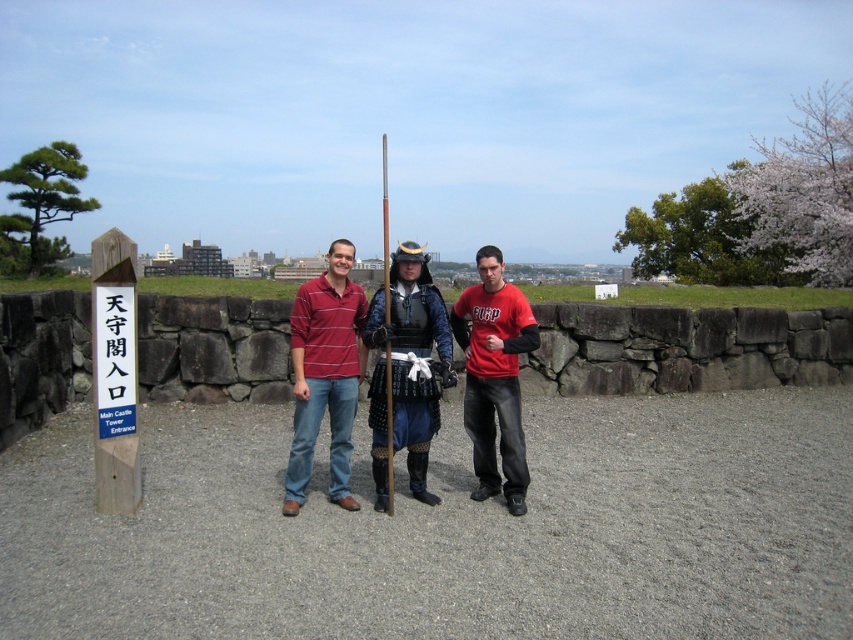
Between matte black armor at center and black textured armor at center, which one has less height?

black textured armor at center is shorter.

Identify the location of matte black armor at center. The width and height of the screenshot is (853, 640). (410, 310).

Between striped cotton polo shirt at center and black textured armor at center, which one appears on the left side from the viewer's perspective?

Positioned to the left is striped cotton polo shirt at center.

Which is behind, point (306, 474) or point (434, 406)?

Point (434, 406)

You are a GUI agent. You are given a task and a screenshot of the screen. Output one action in this format:
    pyautogui.click(x=<x>, y=<y>)
    Task: Click on the striped cotton polo shirt at center
    
    Given the screenshot: What is the action you would take?
    pyautogui.click(x=325, y=374)

Is striped cotton polo shirt at center smaller than red matte shirt at center?

Yes, striped cotton polo shirt at center is smaller than red matte shirt at center.

Does striped cotton polo shirt at center appear on the left side of red matte shirt at center?

Yes, striped cotton polo shirt at center is to the left of red matte shirt at center.

Is point (323, 298) closer to viewer compared to point (465, 378)?

Yes.

Where is `striped cotton polo shirt at center`? The image size is (853, 640). striped cotton polo shirt at center is located at coordinates (325, 374).